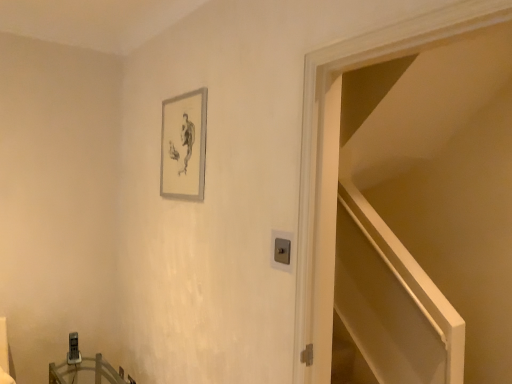
This screenshot has width=512, height=384. What are the coordinates of `silver metallic picture frame at upper center` in the screenshot? It's located at (184, 146).

Identify the location of wooden table at lower left. This screenshot has width=512, height=384. (87, 372).

Locate an element on the screen. This screenshot has height=384, width=512. silver metallic picture frame at upper center is located at coordinates (184, 146).

From a real-world perspective, which is physically above, wooden table at lower left or silver metallic picture frame at upper center?

From a 3D spatial view, silver metallic picture frame at upper center is above.

Considering the positions of points (53, 380) and (174, 131), is point (53, 380) farther from camera compared to point (174, 131)?

Yes, point (53, 380) is behind point (174, 131).

Find the location of a particular element. The image size is (512, 384). table located on the left of silver metallic picture frame at upper center is located at coordinates (87, 372).

Can you confirm if wooden table at lower left is bigger than silver metallic picture frame at upper center?

Yes, wooden table at lower left is bigger than silver metallic picture frame at upper center.

Considering the relative sizes of wooden table at lower left and white glossy door at upper right in the image provided, is wooden table at lower left taller than white glossy door at upper right?

No, wooden table at lower left is not taller than white glossy door at upper right.

Image resolution: width=512 pixels, height=384 pixels. I want to click on door positioned vertically above the wooden table at lower left (from a real-world perspective), so click(323, 123).

Is point (102, 375) positioned before point (471, 17)?

No, it is not.

Based on the photo, how different are the orientations of silver metallic picture frame at upper center and white glossy door at upper right in degrees?

0.767 degrees.

Which object is further away from the camera taking this photo, silver metallic picture frame at upper center or white glossy door at upper right?

Positioned behind is silver metallic picture frame at upper center.

Which is more to the right, silver metallic picture frame at upper center or white glossy door at upper right?

white glossy door at upper right.

In terms of height, does silver metallic picture frame at upper center look taller or shorter compared to white glossy door at upper right?

silver metallic picture frame at upper center is shorter than white glossy door at upper right.

Is silver metallic picture frame at upper center looking in the opposite direction of wooden table at lower left?

No.

Can you see silver metallic picture frame at upper center touching wooden table at lower left?

They are not placed beside each other.

Based on their sizes in the image, would you say silver metallic picture frame at upper center is bigger or smaller than wooden table at lower left?

Considering their sizes, silver metallic picture frame at upper center takes up less space than wooden table at lower left.

Between white glossy door at upper right and wooden table at lower left, which one has larger width?

wooden table at lower left.

Is white glossy door at upper right turned away from wooden table at lower left?

No, white glossy door at upper right is not facing the opposite direction of wooden table at lower left.

The image size is (512, 384). In order to click on table below the white glossy door at upper right (from the image's perspective) in this screenshot , I will do `click(87, 372)`.

Which is correct: white glossy door at upper right is inside wooden table at lower left, or outside of it?

white glossy door at upper right exists outside the volume of wooden table at lower left.

From a real-world perspective, which object rests below the other?

white glossy door at upper right, from a real-world perspective.

Is white glossy door at upper right positioned behind silver metallic picture frame at upper center?

No.

Could you tell me if white glossy door at upper right is facing silver metallic picture frame at upper center?

No, white glossy door at upper right is not aimed at silver metallic picture frame at upper center.

Considering the relative positions of white glossy door at upper right and silver metallic picture frame at upper center in the image provided, is white glossy door at upper right to the left of silver metallic picture frame at upper center from the viewer's perspective?

No, white glossy door at upper right is not to the left of silver metallic picture frame at upper center.

Locate an element on the screen. Image resolution: width=512 pixels, height=384 pixels. picture frame above the wooden table at lower left (from the image's perspective) is located at coordinates (184, 146).

Locate an element on the screen. The image size is (512, 384). table lying behind the white glossy door at upper right is located at coordinates (87, 372).

Considering their positions, is white glossy door at upper right positioned further to wooden table at lower left than silver metallic picture frame at upper center?

white glossy door at upper right is positioned further to the anchor wooden table at lower left.

Estimate the real-world distances between objects in this image. Which object is closer to silver metallic picture frame at upper center, wooden table at lower left or white glossy door at upper right?

white glossy door at upper right lies closer to silver metallic picture frame at upper center than the other object.

Which object lies nearer to the anchor point wooden table at lower left, silver metallic picture frame at upper center or white glossy door at upper right?

silver metallic picture frame at upper center.

Which object lies further to the anchor point silver metallic picture frame at upper center, white glossy door at upper right or wooden table at lower left?

wooden table at lower left is positioned further to the anchor silver metallic picture frame at upper center.

Which object lies nearer to the anchor point white glossy door at upper right, wooden table at lower left or silver metallic picture frame at upper center?

silver metallic picture frame at upper center is positioned closer to the anchor white glossy door at upper right.

Which object lies nearer to the anchor point white glossy door at upper right, silver metallic picture frame at upper center or wooden table at lower left?

silver metallic picture frame at upper center is closer to white glossy door at upper right.

At what (x,y) coordinates should I click in order to perform the action: click on door between silver metallic picture frame at upper center and wooden table at lower left vertically. Please return your answer as a coordinate pair (x, y). Looking at the image, I should click on (323, 123).